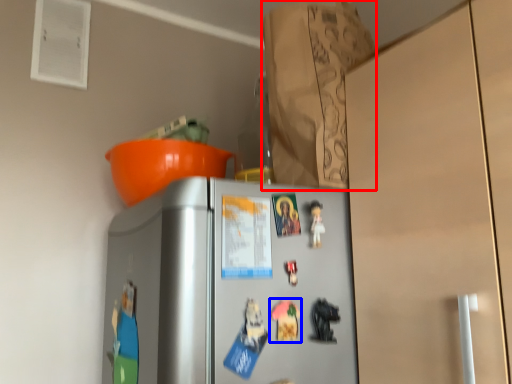
Question: Which object appears farthest to the camera in this image, paper bag (highlighted by a red box) or toy (highlighted by a blue box)?

Choices:
 (A) paper bag
 (B) toy

Answer: (A)